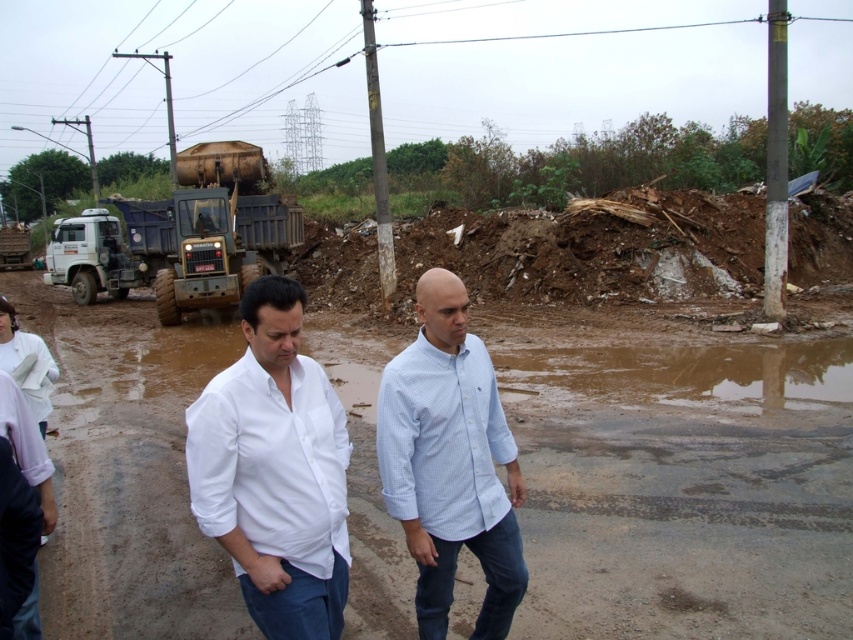
Does white cotton shirt at center have a lesser width compared to light blue checkered shirt at center?

Indeed, white cotton shirt at center has a lesser width compared to light blue checkered shirt at center.

Who is lower down, white cotton shirt at center or light blue checkered shirt at center?

light blue checkered shirt at center

Does point (315, 506) come farther from viewer compared to point (430, 516)?

No, it is not.

Where is `white cotton shirt at center`? white cotton shirt at center is located at coordinates (274, 470).